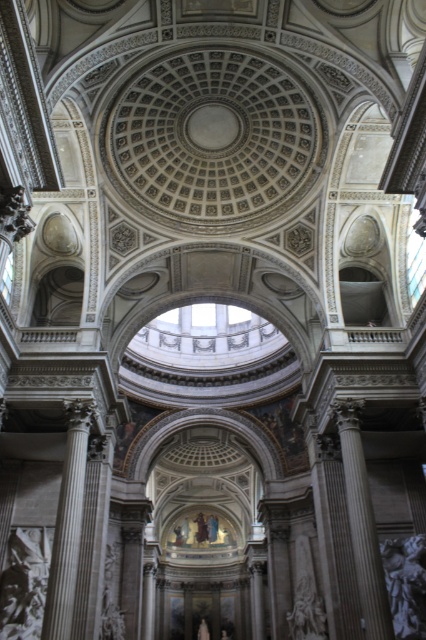
Question: Does white marble column at left appear on the right side of gray marble column at right?

Choices:
 (A) yes
 (B) no

Answer: (B)

Question: Among these objects, which one is farthest from the camera?

Choices:
 (A) white marble column at left
 (B) gray marble column at right

Answer: (B)

Question: Is white marble column at left wider than gray marble column at right?

Choices:
 (A) yes
 (B) no

Answer: (B)

Question: Is white marble column at left further to the viewer compared to gray marble column at right?

Choices:
 (A) yes
 (B) no

Answer: (B)

Question: Which point appears closest to the camera in this image?

Choices:
 (A) (66, 636)
 (B) (351, 499)

Answer: (A)